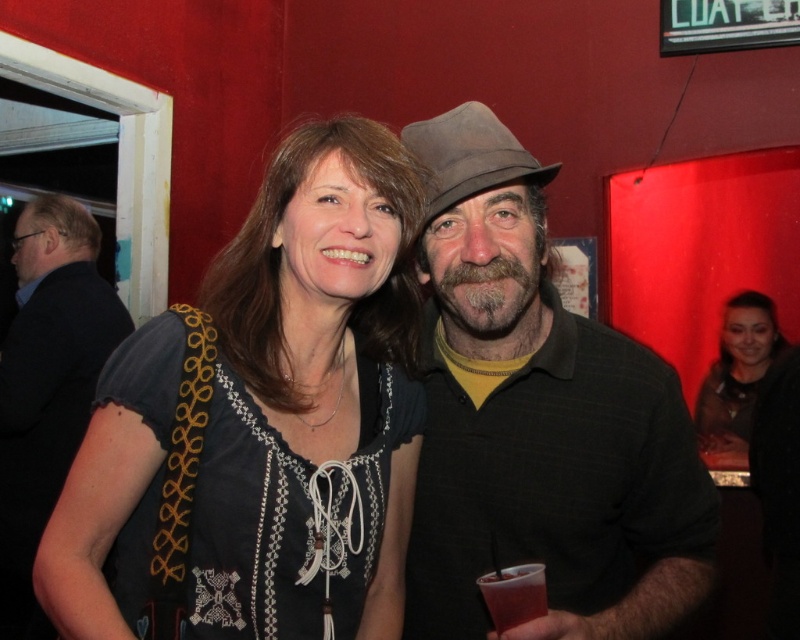
Question: Where is dark blue embroidered shirt at center located in relation to black fabric shirt at left in the image?

Choices:
 (A) below
 (B) above

Answer: (B)

Question: Which point appears farthest from the camera in this image?

Choices:
 (A) (428, 275)
 (B) (48, 484)
 (C) (733, 324)

Answer: (C)

Question: Which object is closer to the camera taking this photo?

Choices:
 (A) dark green textured shirt at center
 (B) graywoollybeard at center
 (C) smooth brown hair at center

Answer: (A)

Question: Among these objects, which one is nearest to the camera?

Choices:
 (A) graywoollybeard at center
 (B) brown felt fedora at center

Answer: (A)

Question: Does dark green textured shirt at center have a smaller size compared to translucent plastic cup at lower right?

Choices:
 (A) no
 (B) yes

Answer: (A)

Question: Can you confirm if smooth brown hair at center is positioned above translucent plastic cup at lower right?

Choices:
 (A) no
 (B) yes

Answer: (B)